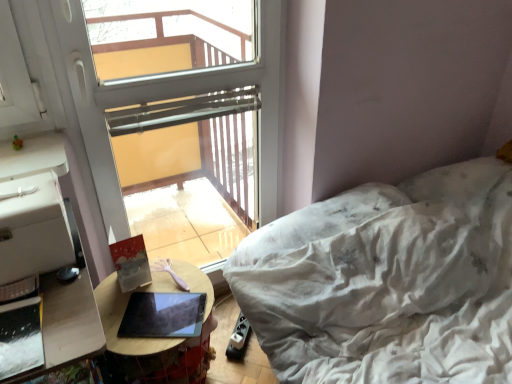
Question: Would you say white textured bed at right is to the left or to the right of wooden table at lower left in the picture?

Choices:
 (A) right
 (B) left

Answer: (A)

Question: From the image's perspective, relative to wooden table at lower left, is white textured bed at right above or below?

Choices:
 (A) above
 (B) below

Answer: (A)

Question: Estimate the real-world distances between objects in this image. Which object is closer to the transparent glass window at upper center?

Choices:
 (A) white textured bed at right
 (B) wooden table at lower left
 (C) matte black tablet at center

Answer: (B)

Question: Which object is positioned closest to the matte black tablet at center?

Choices:
 (A) white textured bed at right
 (B) transparent glass window at upper center
 (C) wooden table at lower left

Answer: (C)